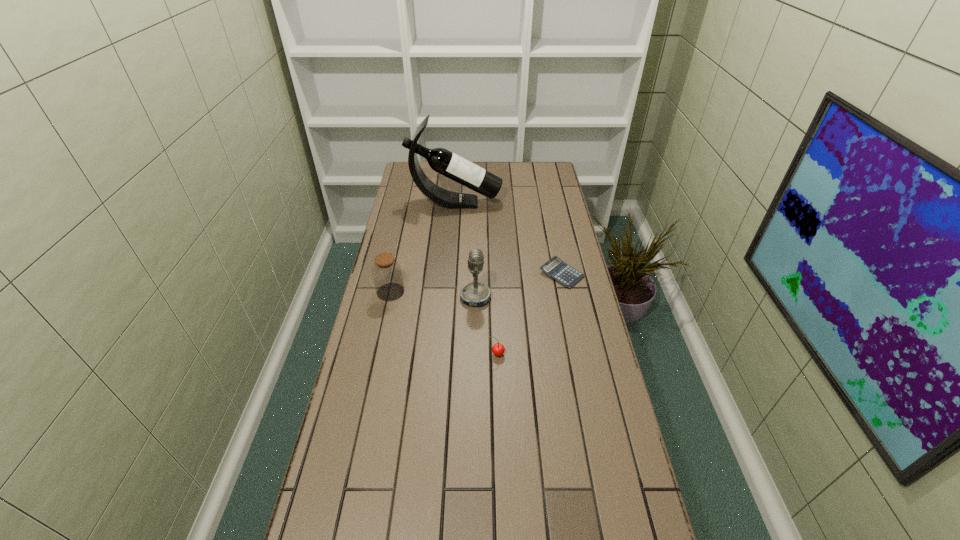
What are the coordinates of `free space located 0.180m on the back of the jar` in the screenshot? It's located at (399, 252).

Locate an element on the screen. vacant region located 0.110m on the left of the nearest object is located at coordinates (452, 354).

The height and width of the screenshot is (540, 960). Identify the location of vacant space situated 0.240m on the left of the calculator. (474, 274).

Locate an element on the screen. The height and width of the screenshot is (540, 960). wine bottle located in the left edge section of the desktop is located at coordinates (441, 160).

At what (x,y) coordinates should I click in order to perform the action: click on jar that is positioned at the left edge. Please return your answer as a coordinate pair (x, y). The height and width of the screenshot is (540, 960). Looking at the image, I should click on (386, 271).

Find the location of `object that is positioned at the right edge`. object that is positioned at the right edge is located at coordinates (555, 268).

In the image, there is a desktop. Identify the location of vacant space at the far edge. This screenshot has height=540, width=960. (505, 161).

This screenshot has height=540, width=960. I want to click on vacant region at the left edge, so click(384, 373).

Where is `vacant space at the right edge of the desktop`? The image size is (960, 540). vacant space at the right edge of the desktop is located at coordinates (636, 518).

What are the coordinates of `free space at the far left corner of the desktop` in the screenshot? It's located at (428, 168).